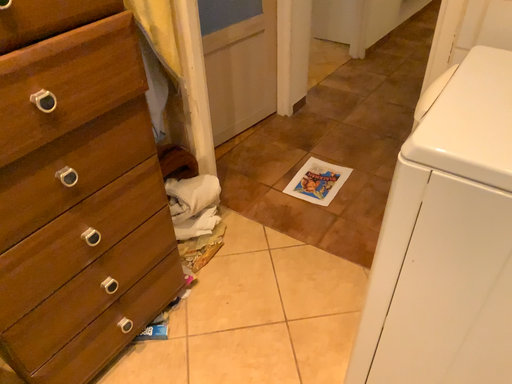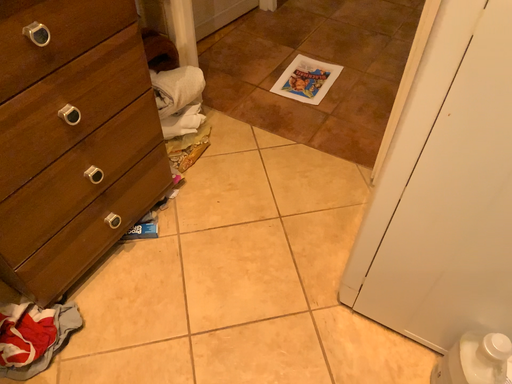
Question: Which way did the camera rotate in the video?

Choices:
 (A) rotated downward
 (B) rotated upward

Answer: (A)